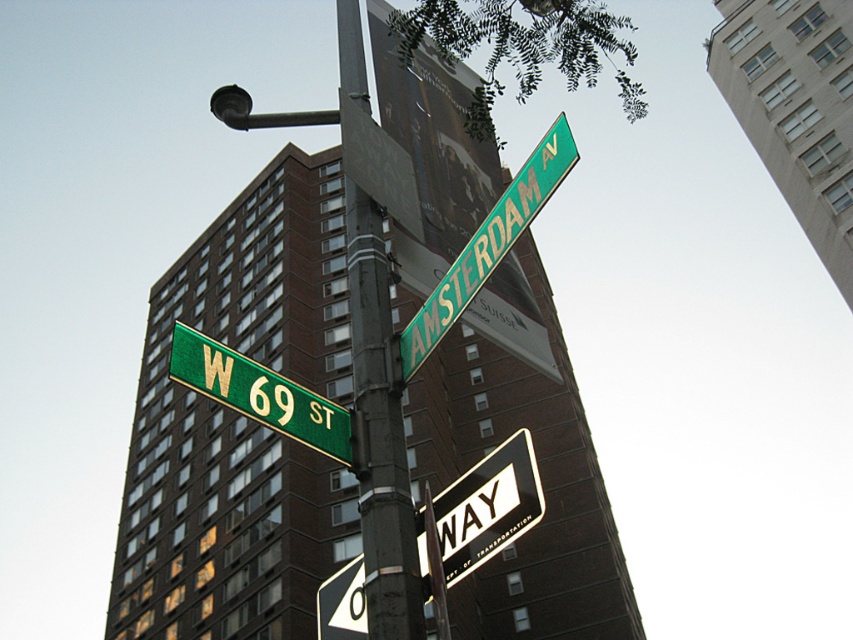
Between metallic pole at center and white plastic one-way sign at upper center, which one is positioned lower?

white plastic one-way sign at upper center is lower down.

Does metallic pole at center have a lesser width compared to white plastic one-way sign at upper center?

Incorrect, metallic pole at center's width is not less than white plastic one-way sign at upper center's.

Who is more distant from viewer, (393, 410) or (521, 531)?

The point (393, 410) is behind.

Image resolution: width=853 pixels, height=640 pixels. Identify the location of metallic pole at center. (380, 433).

In the scene shown: Who is more distant from viewer, (454, 576) or (228, 372)?

Point (228, 372)

Does point (519, 456) lie behind point (346, 449)?

No, it is in front of (346, 449).

Image resolution: width=853 pixels, height=640 pixels. What are the coordinates of `white plastic one-way sign at upper center` in the screenshot? It's located at (486, 506).

Which of these two, white plastic one-way sign at upper center or green metallic street sign at upper center, stands taller?

green metallic street sign at upper center is taller.

How far apart are white plastic one-way sign at upper center and green metallic street sign at upper center?

white plastic one-way sign at upper center is 7.77 feet away from green metallic street sign at upper center.

The image size is (853, 640). In order to click on white plastic one-way sign at upper center in this screenshot , I will do `click(486, 506)`.